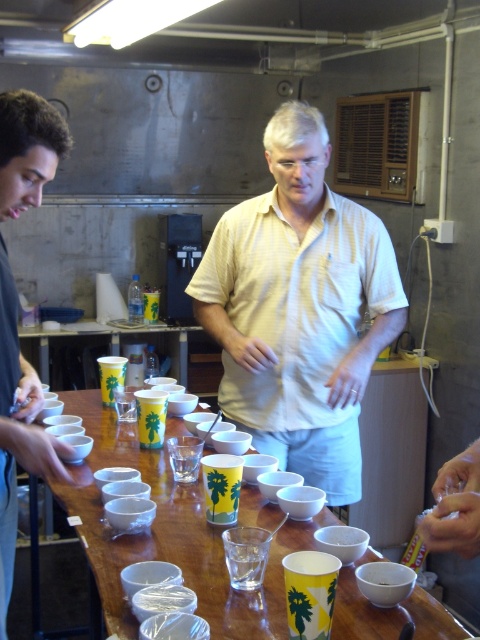
Question: Can you confirm if yellow striped shirt at center is smaller than wooden table at center?

Choices:
 (A) no
 (B) yes

Answer: (B)

Question: Considering the relative positions of wooden table at center and brown curly hair at left in the image provided, where is wooden table at center located with respect to brown curly hair at left?

Choices:
 (A) below
 (B) above

Answer: (A)

Question: Which of these objects is positioned closest to the yellow striped shirt at center?

Choices:
 (A) yellow paper cups at center
 (B) wooden table at center

Answer: (B)

Question: Is brown curly hair at left below yellow paper cups at center?

Choices:
 (A) yes
 (B) no

Answer: (B)

Question: Among these objects, which one is farthest from the camera?

Choices:
 (A) yellow paper cups at center
 (B) wooden table at center
 (C) brown curly hair at left
 (D) yellow striped shirt at center

Answer: (A)

Question: Which point is farther to the camera?

Choices:
 (A) brown curly hair at left
 (B) yellow paper cups at center

Answer: (B)